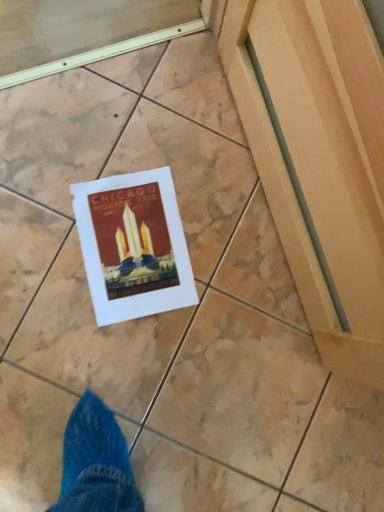
You are a GUI agent. You are given a task and a screenshot of the screen. Output one action in this format:
    pyautogui.click(x=<x>, y=<y>)
    Task: Click on the vacant space behind matte paper postcard at center
    This screenshot has width=384, height=512.
    Given the screenshot: What is the action you would take?
    pyautogui.click(x=184, y=157)